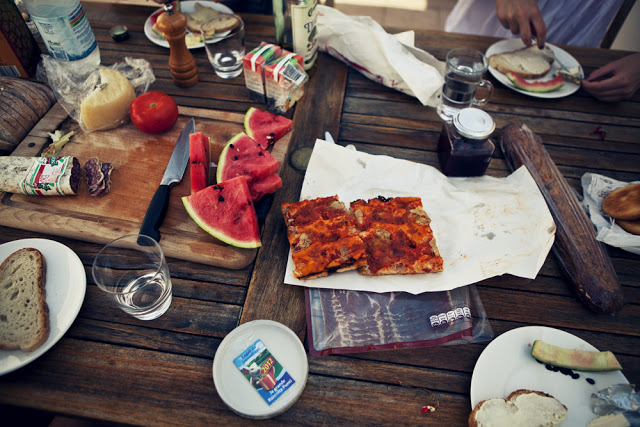
This screenshot has height=427, width=640. Identify the location of glass cup. (230, 48), (150, 287), (449, 78).